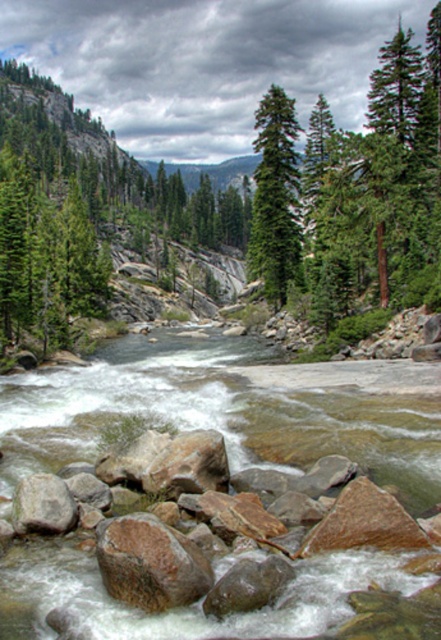
You are standing at the origin point of the image coordinate system, which is the bottom left corner. You want to locate the brown rock river at center. What are its coordinates?

The coordinates of the brown rock river at center are at point (216, 413).